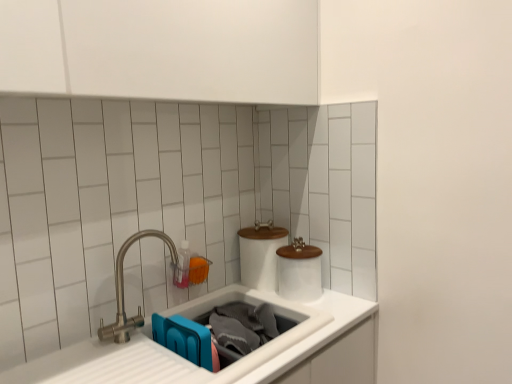
This screenshot has width=512, height=384. What are the coordinates of `vacant region to the right of white glossy toilet paper at center, which is the 2th toilet paper in left-to-right order` in the screenshot? It's located at (342, 296).